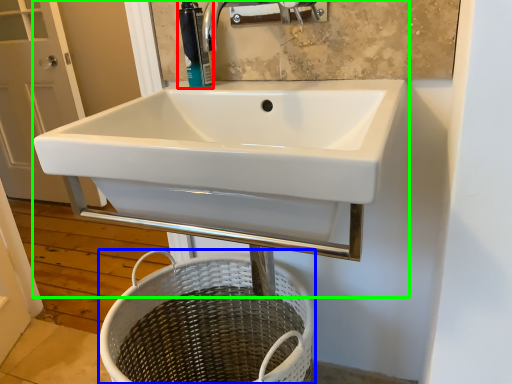
Question: Considering the real-world distances, which object is farthest from soap dispenser (highlighted by a red box)? basket (highlighted by a blue box) or sink (highlighted by a green box)?

Choices:
 (A) basket
 (B) sink

Answer: (A)